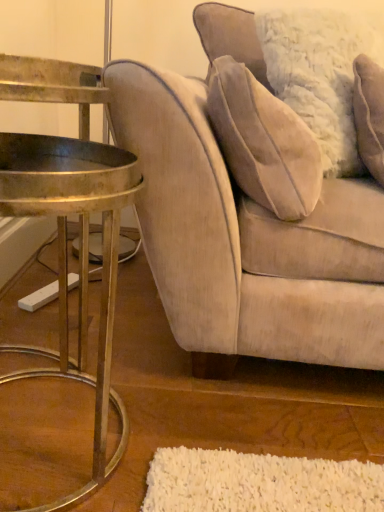
Question: Is velvet beige couch at right wider than gold metallic table at left?

Choices:
 (A) no
 (B) yes

Answer: (B)

Question: Is velvet beige couch at right touching gold metallic table at left?

Choices:
 (A) no
 (B) yes

Answer: (A)

Question: Is velvet beige couch at right behind gold metallic table at left?

Choices:
 (A) no
 (B) yes

Answer: (B)

Question: Is velvet beige couch at right to the left of gold metallic table at left from the viewer's perspective?

Choices:
 (A) no
 (B) yes

Answer: (A)

Question: Is gold metallic table at left surrounded by velvet beige couch at right?

Choices:
 (A) yes
 (B) no

Answer: (B)

Question: From a real-world perspective, does velvet beige couch at right sit lower than gold metallic table at left?

Choices:
 (A) no
 (B) yes

Answer: (A)

Question: From the image's perspective, is gold metallic table at left above velvet beige pillow at upper right?

Choices:
 (A) yes
 (B) no

Answer: (B)

Question: Considering the relative positions of gold metallic table at left and velvet beige pillow at upper right in the image provided, is gold metallic table at left behind velvet beige pillow at upper right?

Choices:
 (A) no
 (B) yes

Answer: (A)

Question: Is gold metallic table at left at the left side of velvet beige pillow at upper right?

Choices:
 (A) no
 (B) yes

Answer: (B)

Question: From a real-world perspective, is gold metallic table at left located higher than velvet beige pillow at upper right?

Choices:
 (A) no
 (B) yes

Answer: (A)

Question: Would you consider gold metallic table at left to be distant from velvet beige pillow at upper right?

Choices:
 (A) yes
 (B) no

Answer: (B)

Question: Is gold metallic table at left to the right of velvet beige pillow at upper right from the viewer's perspective?

Choices:
 (A) yes
 (B) no

Answer: (B)

Question: Is velvet beige pillow at upper right outside gold metallic table at left?

Choices:
 (A) no
 (B) yes

Answer: (B)